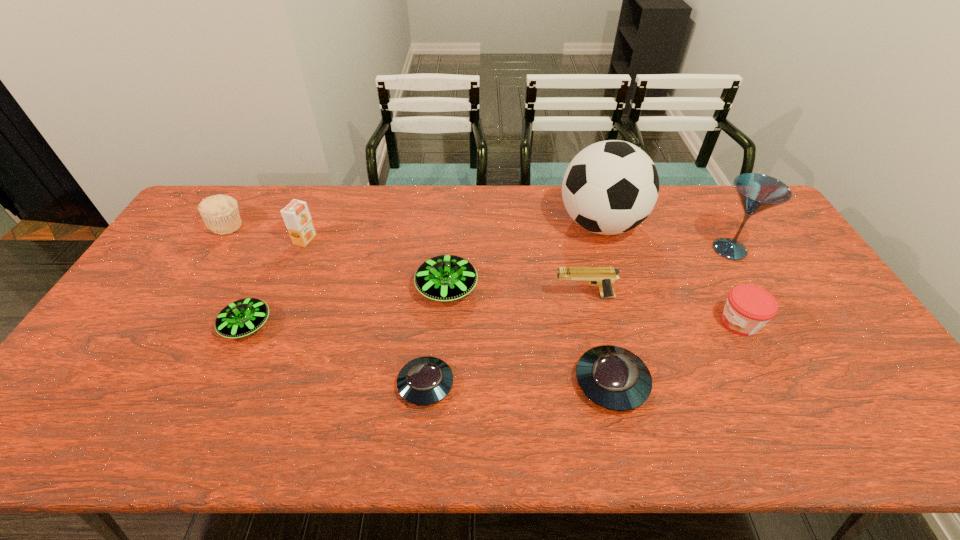
Where is `free region located 0.060m on the right of the beige muffin`? free region located 0.060m on the right of the beige muffin is located at coordinates (262, 226).

Find the location of a particular element. The image size is (960, 540). vacant region located at the barrel of the tan pistol is located at coordinates (480, 296).

You are a GUI agent. You are given a task and a screenshot of the screen. Output one action in this format:
    pyautogui.click(x=<x>, y=<y>)
    Task: Click on the vacant space located at the barrel of the tan pistol
    The image size is (960, 540).
    Given the screenshot: What is the action you would take?
    pyautogui.click(x=473, y=296)

The image size is (960, 540). Find the location of `free space located 0.080m at the barrel of the tan pistol`. free space located 0.080m at the barrel of the tan pistol is located at coordinates (525, 296).

You are a GUI agent. You are given a task and a screenshot of the screen. Output one action in this format:
    pyautogui.click(x=<x>, y=<y>)
    Task: Click on the vacant space located on the label side of the jam
    
    Given the screenshot: What is the action you would take?
    pyautogui.click(x=656, y=322)

Locate an element on the screen. vacant area situated 0.170m on the label side of the jam is located at coordinates point(656,322).

Where is `free spot located 0.100m on the label side of the jam`? Image resolution: width=960 pixels, height=540 pixels. free spot located 0.100m on the label side of the jam is located at coordinates pyautogui.click(x=681, y=322).

At what (x,y) coordinates should I click in order to perform the action: click on vacant space located on the right of the tallest saucer. Please return your answer as a coordinate pair (x, y). Looking at the image, I should click on (560, 288).

Where is `vacant region located on the front of the smaller green saucer`? This screenshot has height=540, width=960. vacant region located on the front of the smaller green saucer is located at coordinates (213, 399).

Locate an element on the screen. The width and height of the screenshot is (960, 540). vacant space located 0.120m on the back of the rightmost saucer is located at coordinates (596, 315).